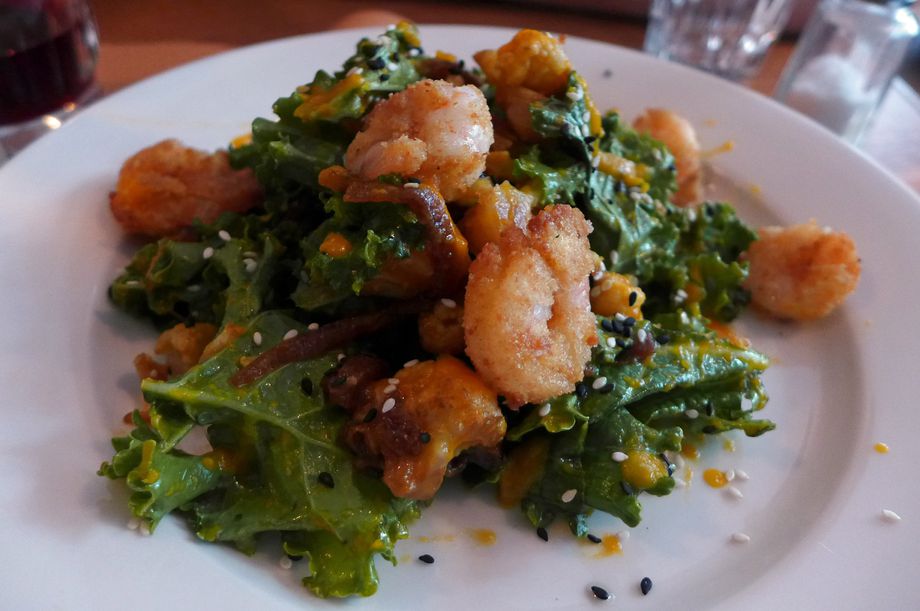
This screenshot has width=920, height=611. Identify the location of tabletop. (142, 43).